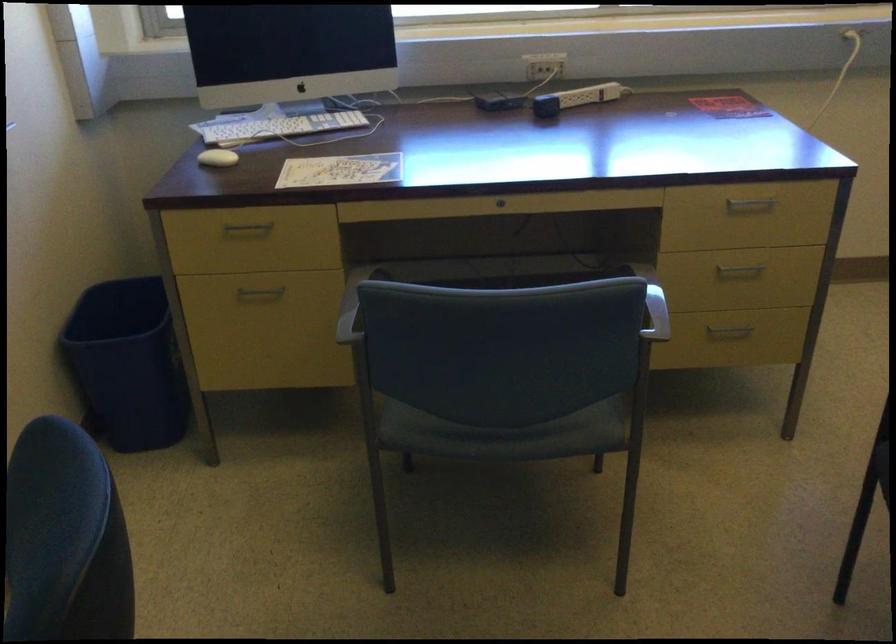
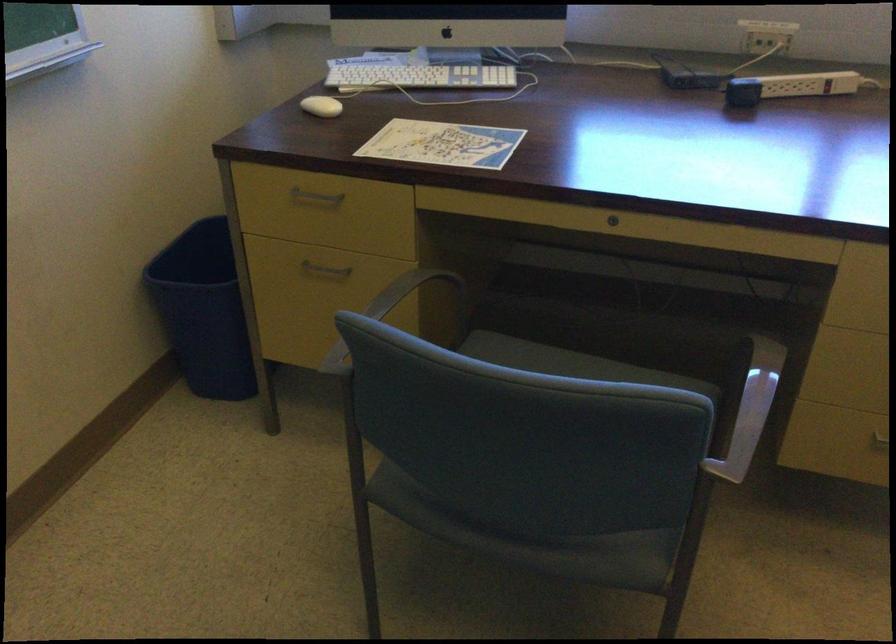
Find the pixel in the second image that matches (328,315) in the first image.

(393, 308)